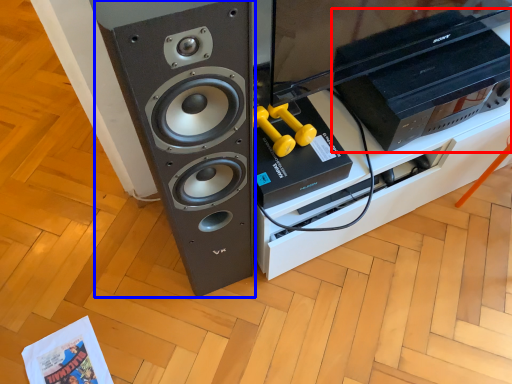
Question: Which of the following is the closest to the observer, home appliance (highlighted by a red box) or speaker (highlighted by a blue box)?

Choices:
 (A) home appliance
 (B) speaker

Answer: (B)